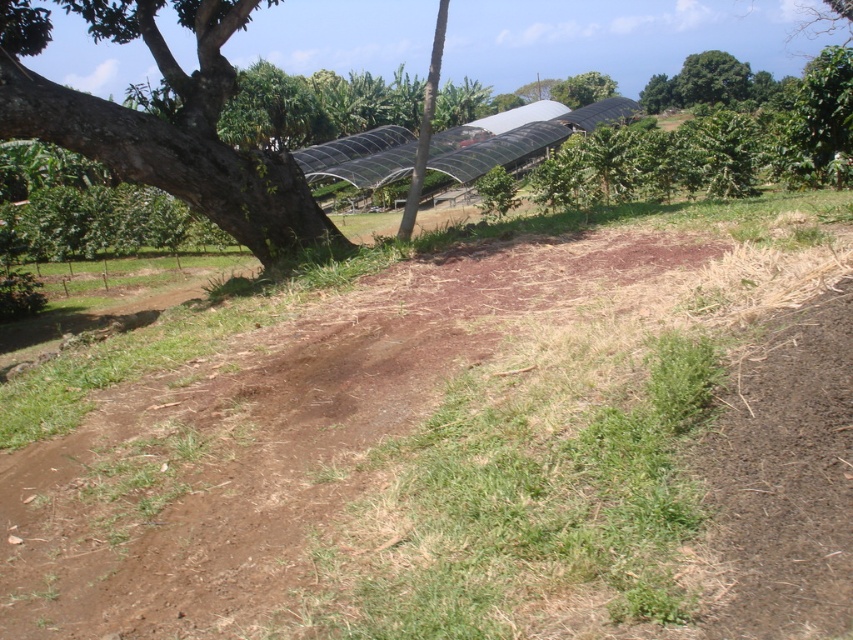
Question: Does green leafy tree at upper right appear on the left side of green leafy tree at upper center?

Choices:
 (A) no
 (B) yes

Answer: (A)

Question: Is brown rough bark tree at left bigger than green leafy tree at upper right?

Choices:
 (A) yes
 (B) no

Answer: (B)

Question: Which is nearer to the brown rough bark tree at left?

Choices:
 (A) brown soil at center
 (B) green leafy tree at upper right

Answer: (A)

Question: Which of the following is the farthest from the observer?

Choices:
 (A) brown soil at center
 (B) brown rough bark tree at left
 (C) green leafy tree at upper right

Answer: (C)

Question: Can you confirm if brown rough bark tree at left is positioned to the right of green leafy tree at upper center?

Choices:
 (A) yes
 (B) no

Answer: (B)

Question: Which point is farther to the camera?

Choices:
 (A) (709, 296)
 (B) (189, 74)
 (C) (570, 92)

Answer: (B)